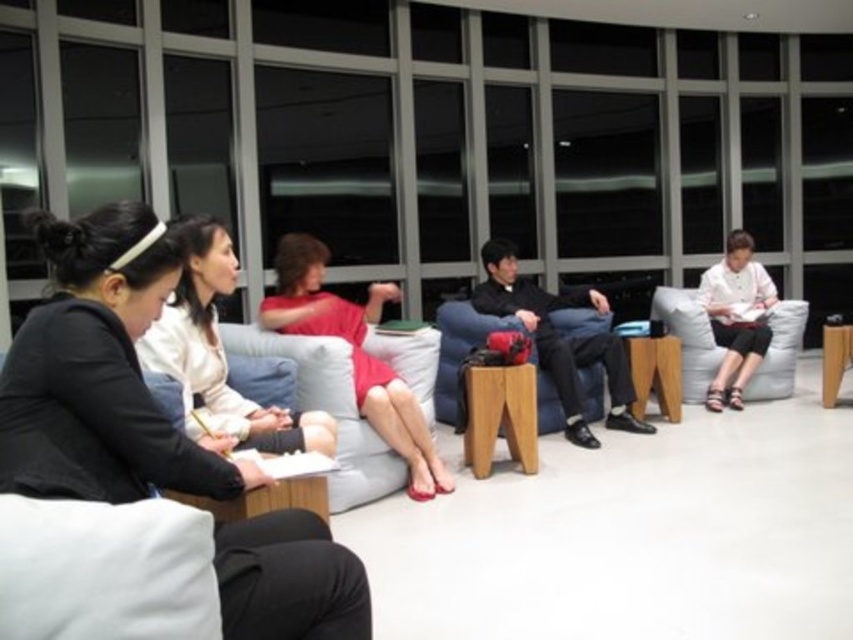
Does matte black jacket at left appear on the left side of white fabric couch at center?

No, matte black jacket at left is not to the left of white fabric couch at center.

Does point (183, 483) come farther from viewer compared to point (346, 429)?

No.

Is point (3, 476) positioned before point (399, 374)?

Yes, it is in front of point (399, 374).

At what (x,y) coordinates should I click in order to perform the action: click on matte black jacket at left. Please return your answer as a coordinate pair (x, y). Looking at the image, I should click on (100, 372).

Who is higher up, matte black jacket at left or white fabric couch at right?

Positioned higher is white fabric couch at right.

Between matte black jacket at left and white fabric couch at right, which one has less height?

Standing shorter between the two is matte black jacket at left.

Who is more distant from viewer, [219,545] or [785,320]?

The point [785,320] is behind.

Where is `matte black jacket at left`? matte black jacket at left is located at coordinates (100, 372).

Does matte black jacket at center appear under white matte shirt at right?

Indeed, matte black jacket at center is positioned under white matte shirt at right.

Is matte black jacket at center behind white matte shirt at right?

No, matte black jacket at center is closer to the viewer.

This screenshot has height=640, width=853. I want to click on matte black jacket at center, so click(x=219, y=353).

Where is `matte black jacket at center`? The width and height of the screenshot is (853, 640). matte black jacket at center is located at coordinates (219, 353).